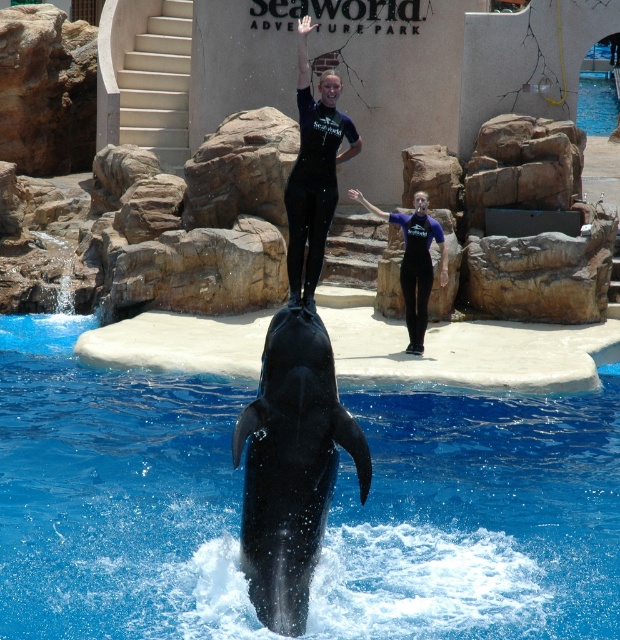
Question: Can you confirm if black smooth whale at center is smaller than black matte wetsuit at center?

Choices:
 (A) no
 (B) yes

Answer: (B)

Question: Which of these objects is positioned closest to the blue smooth water at center?

Choices:
 (A) blue matte wetsuit at center
 (B) black smooth whale at center

Answer: (B)

Question: Which object is positioned farthest from the blue matte wetsuit at center?

Choices:
 (A) black matte wetsuit at center
 (B) black smooth whale at center
 (C) blue smooth water at center

Answer: (B)

Question: Which object appears farthest from the camera in this image?

Choices:
 (A) black smooth whale at center
 (B) blue smooth water at center
 (C) black matte wetsuit at center
 (D) blue matte wetsuit at center

Answer: (D)

Question: Can you confirm if black smooth whale at center is wider than black matte wetsuit at center?

Choices:
 (A) no
 (B) yes

Answer: (A)

Question: Does blue smooth water at center appear over black matte wetsuit at center?

Choices:
 (A) yes
 (B) no

Answer: (B)